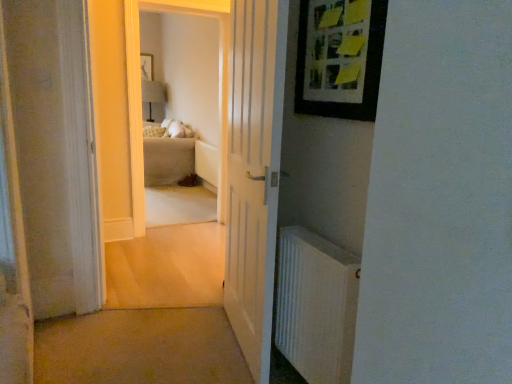
Question: Relative to carpet at center, is matte black picture frame at upper center, which appears as the 1th picture frame when viewed from the back, in front or behind?

Choices:
 (A) front
 (B) behind

Answer: (B)

Question: From the image's perspective, relative to carpet at center, is matte black picture frame at upper center, placed as the second picture frame when sorted from bottom to top, above or below?

Choices:
 (A) above
 (B) below

Answer: (A)

Question: Considering the real-world distances, which object is farthest from the white wooden door at center?

Choices:
 (A) wooden picture frame at upper right, which appears as the first picture frame when viewed from the right
 (B) white plastic radiator at right
 (C) carpet at center
 (D) beige fabric couch at center
 (E) matte white lampshade at upper center

Answer: (E)

Question: Which is farther from the white wooden door at center?

Choices:
 (A) matte black picture frame at upper center, placed as the second picture frame when sorted from bottom to top
 (B) wooden picture frame at upper right, the 1th picture frame from the bottom
 (C) matte white lampshade at upper center
 (D) beige fabric couch at center
 (E) carpet at center

Answer: (A)